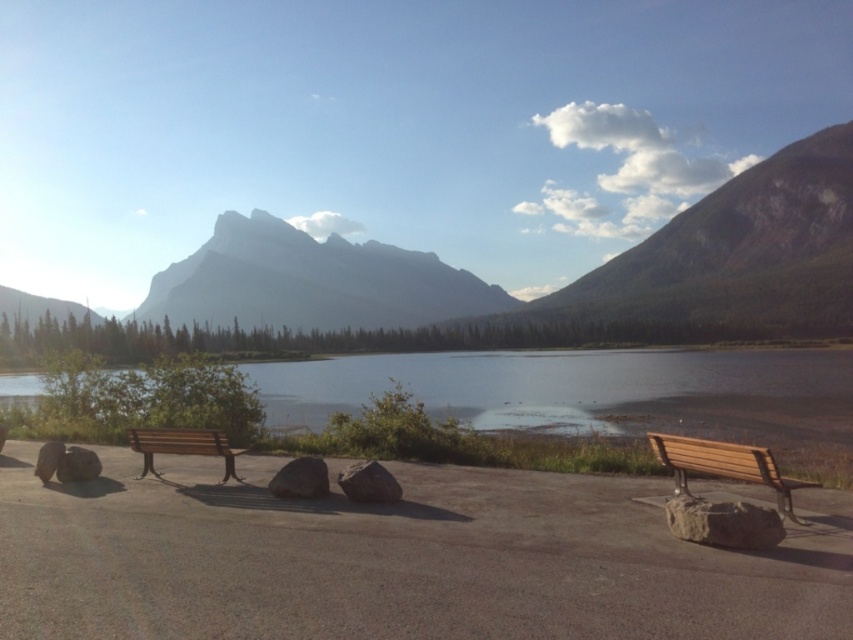
Is matte gray mountain at center to the right of gray rough stone at lower right from the viewer's perspective?

Yes, matte gray mountain at center is to the right of gray rough stone at lower right.

Between matte gray mountain at center and gray rough stone at lower right, which one appears on the right side from the viewer's perspective?

Positioned to the right is matte gray mountain at center.

Which is behind, point (682, 312) or point (691, 506)?

Positioned behind is point (682, 312).

At what (x,y) coordinates should I click in order to perform the action: click on matte gray mountain at center. Please return your answer as a coordinate pair (x, y). Looking at the image, I should click on (503, 291).

Who is more forward, (668, 412) or (368, 486)?

Point (368, 486)

Is point (781, 353) positioned after point (401, 490)?

Yes, point (781, 353) is farther from viewer.

Identify the location of smooth brown water at center. (590, 392).

Looking at this image, who is lower down, gray rough rock at center or gray rock at lower left?

gray rock at lower left is below.

Is gray rough rock at center positioned at the back of gray rock at lower left?

That is False.

This screenshot has height=640, width=853. What do you see at coordinates (368, 483) in the screenshot? I see `gray rough rock at center` at bounding box center [368, 483].

I want to click on gray rough rock at center, so click(368, 483).